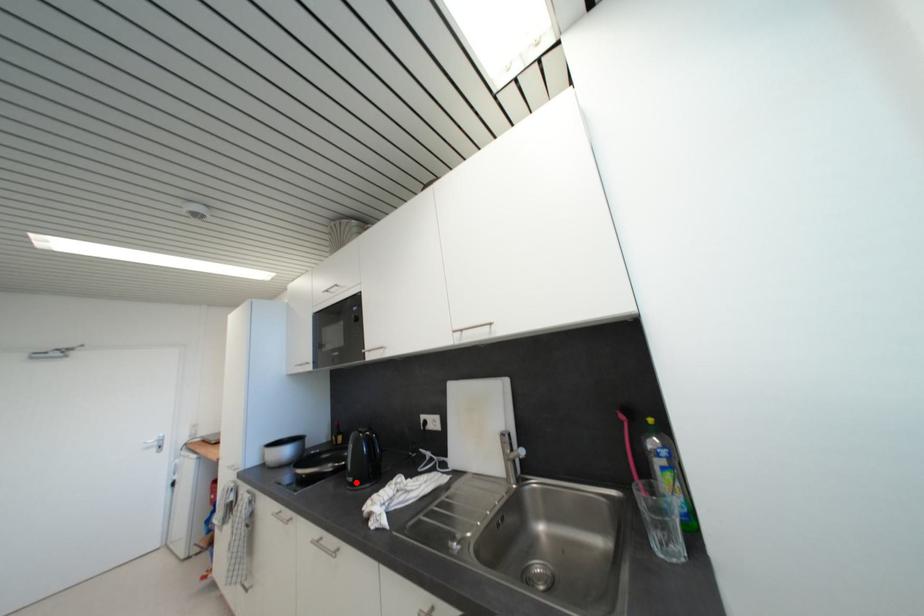
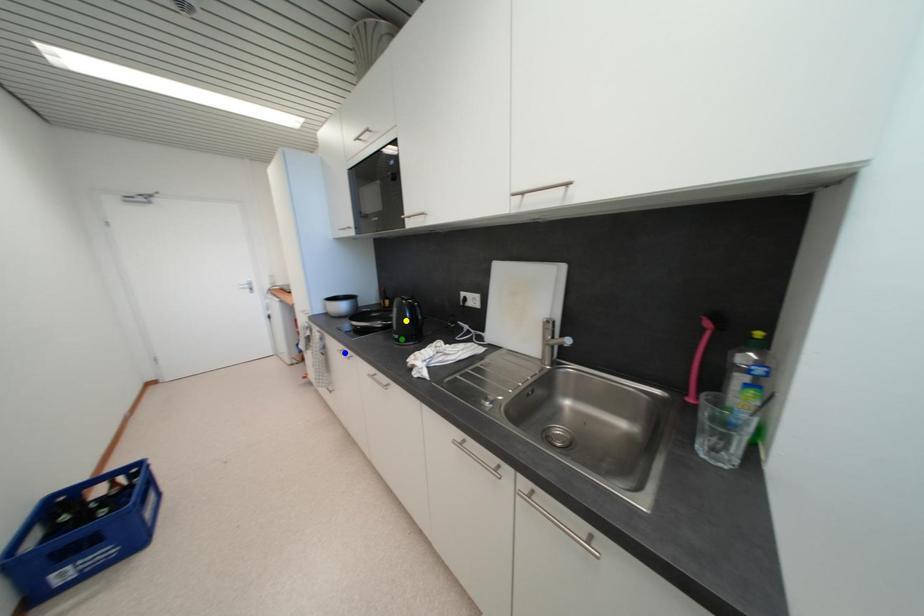
Question: I am providing you with two images of the same scene from different viewpoints. A red point is marked on the first image. You are given multiple points on the second image. Can you choose the point in image 2 that corresponds to the point in image 1?

Choices:
 (A) green point
 (B) blue point
 (C) yellow point

Answer: (A)